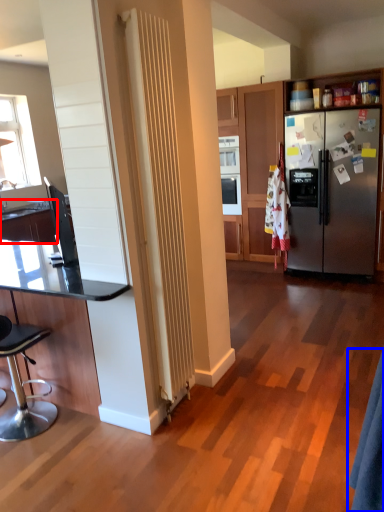
Question: Among these objects, which one is farthest to the camera, countertop (highlighted by a red box) or robe (highlighted by a blue box)?

Choices:
 (A) countertop
 (B) robe

Answer: (A)